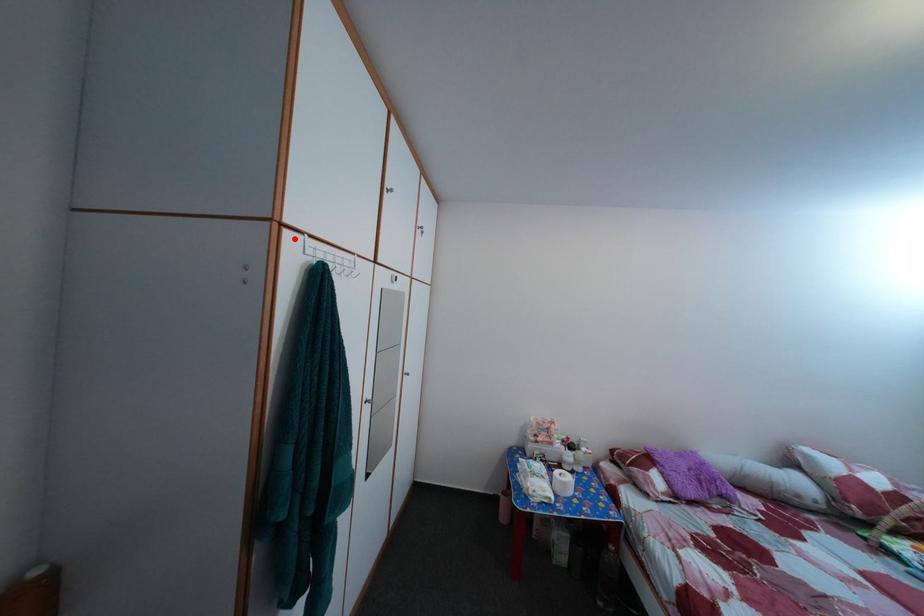
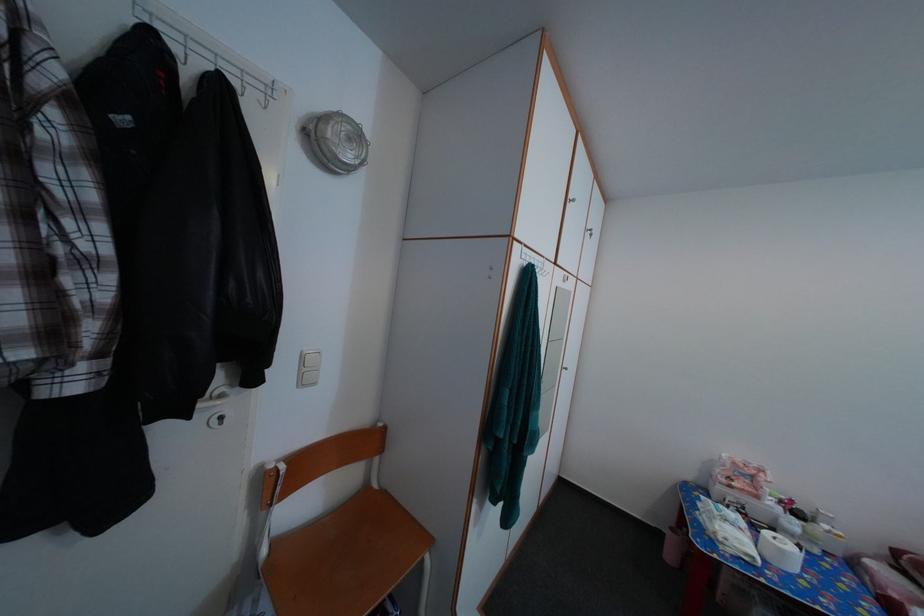
Question: I am providing you with two images of the same scene from different viewpoints. A red point is marked on the first image. Is the red point's position out of view in image 2?

Choices:
 (A) Yes
 (B) No

Answer: (B)